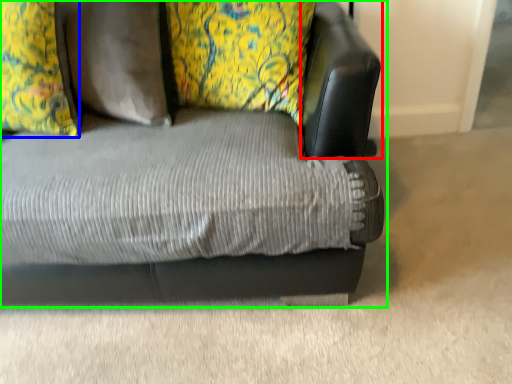
Question: Estimate the real-world distances between objects in this image. Which object is closer to swivel chair (highlighted by a red box), pillow (highlighted by a blue box) or studio couch (highlighted by a green box)?

Choices:
 (A) pillow
 (B) studio couch

Answer: (B)